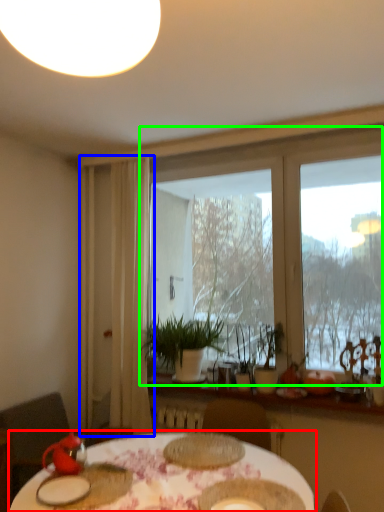
Question: Based on their relative distances, which object is nearer to table (highlighted by a red box)? Choose from curtain (highlighted by a blue box) and window (highlighted by a green box).

Choices:
 (A) curtain
 (B) window

Answer: (A)